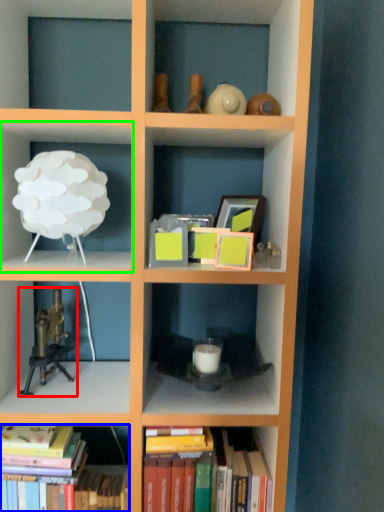
Question: Based on their relative distances, which object is nearer to toy (highlighted by a red box)? Choose from book (highlighted by a blue box) and shelf (highlighted by a green box).

Choices:
 (A) book
 (B) shelf

Answer: (A)